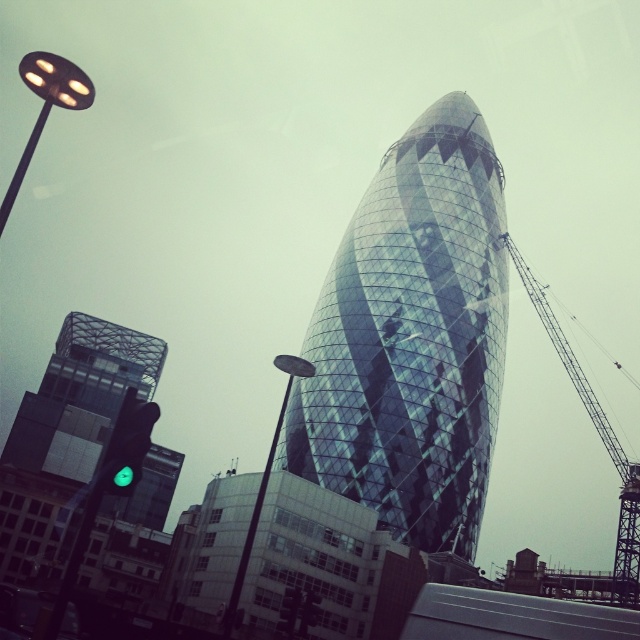
How distant is glassy reflective tower at center from glassy modern building at left?

42.25 meters

Does point (419, 452) lie behind point (160, 362)?

That is False.

Find the location of a particular element. The image size is (640, 640). glassy reflective tower at center is located at coordinates (412, 339).

Does glassy reflective tower at center have a greater height compared to green glass traffic light at lower left?

Indeed, glassy reflective tower at center has a greater height compared to green glass traffic light at lower left.

Which is below, glassy reflective tower at center or green glass traffic light at lower left?

Positioned lower is green glass traffic light at lower left.

The image size is (640, 640). Find the location of `glassy reflective tower at center`. glassy reflective tower at center is located at coordinates (412, 339).

Can you confirm if glassy modern building at left is taller than green glass traffic light at lower left?

Yes, glassy modern building at left is taller than green glass traffic light at lower left.

Does glassy modern building at left appear under green glass traffic light at lower left?

Indeed, glassy modern building at left is positioned under green glass traffic light at lower left.

Which is behind, point (1, 550) or point (131, 417)?

Point (1, 550)

This screenshot has height=640, width=640. I want to click on glassy modern building at left, so [68, 433].